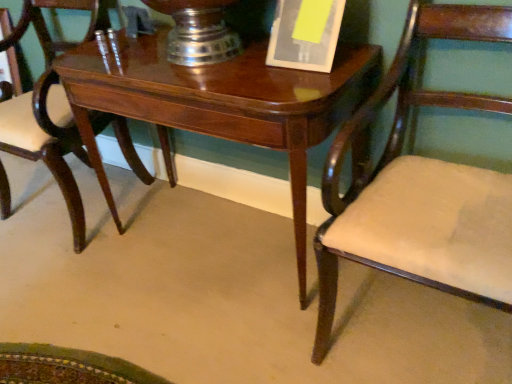
Find the location of a particular element. Image resolution: width=512 pixels, height=384 pixels. vacant space in front of yellow paper at upper center is located at coordinates (297, 83).